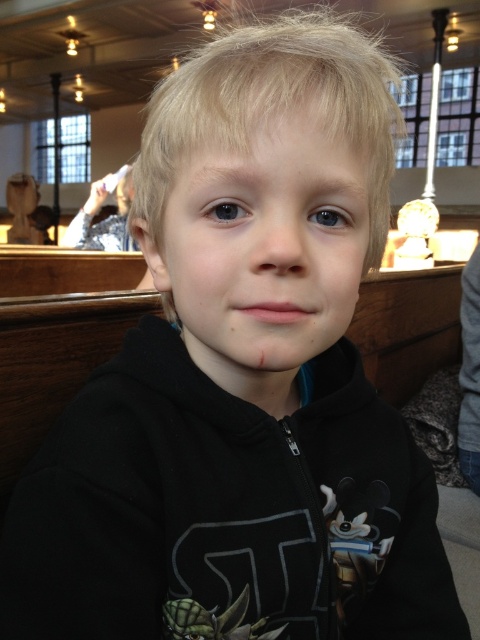
Where is `smooth skin face at center`? smooth skin face at center is located at coordinates [x=264, y=248].

Is the position of smooth skin face at center less distant than that of silver metallic statue at upper left?

Yes, smooth skin face at center is in front of silver metallic statue at upper left.

Which is behind, point (310, 109) or point (100, 188)?

Positioned behind is point (100, 188).

Where is `smooth skin face at center`? The width and height of the screenshot is (480, 640). smooth skin face at center is located at coordinates (264, 248).